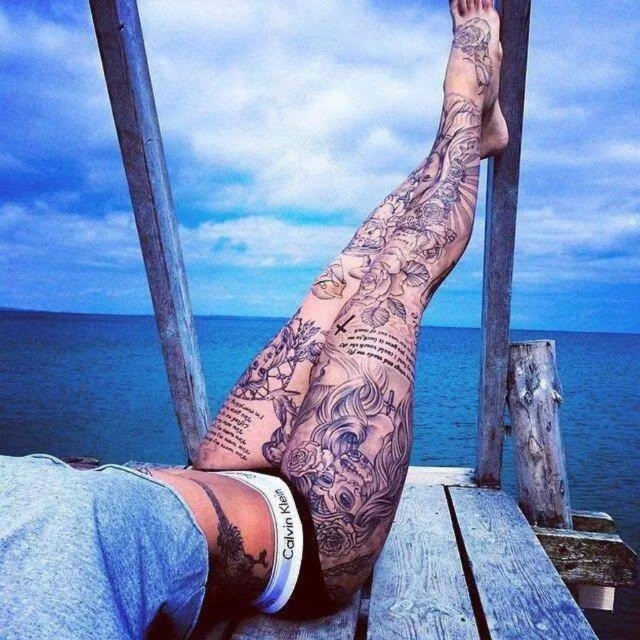
You are a photographer trying to capture the tattooed arm and the water in the same frame. Based on their positions, can you confirm if the black tattooed arm at upper center is above the transparent water at lower center?

Yes, the transparent water at lower center is located below the black tattooed arm at upper center, so the black tattooed arm at upper center is positioned above the transparent water at lower center in the frame.

You are a photographer trying to capture the black tattooed arm at upper center and the transparent water at lower center in a single shot. Based on their widths, which object should you focus on first to ensure both fit in the frame?

The transparent water at lower center is thinner than the black tattooed arm at upper center, so you should focus on the black tattooed arm at upper center first to ensure both fit in the frame.

You are an artist trying to sketch the scene. You need to decide which area to focus on first based on their sizes. Which object should you sketch first, the transparent water at lower center or the black tattooed arm at upper center?

The black tattooed arm at upper center is larger than the transparent water at lower center, so you should sketch the black tattooed arm at upper center first.